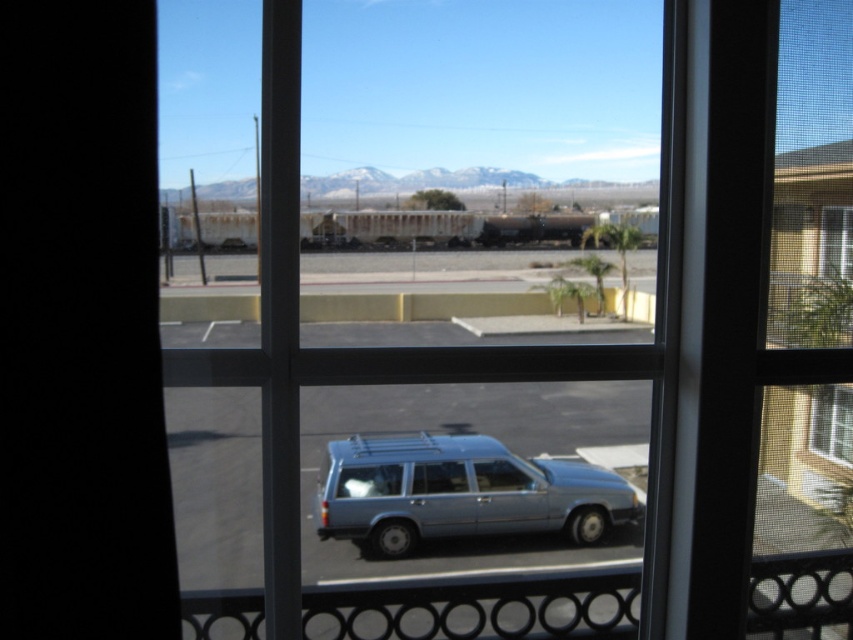
Is clear glass window at center below satin blue station wagon at center?

Incorrect, clear glass window at center is not positioned below satin blue station wagon at center.

Where is `clear glass window at center`? clear glass window at center is located at coordinates (347, 320).

Does point (223, 301) come behind point (498, 518)?

Yes, point (223, 301) is farther from viewer.

Locate an element on the screen. clear glass window at center is located at coordinates (347, 320).